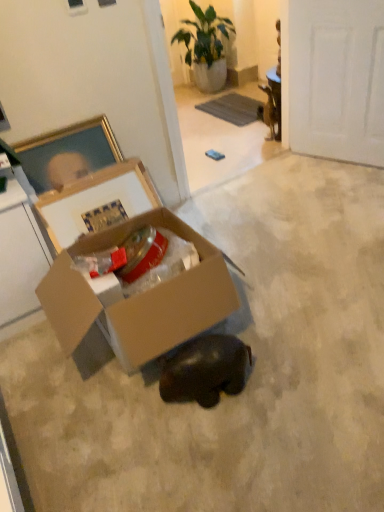
Question: Relative to green leafy plant at upper center, is cardboard box at center in front or behind?

Choices:
 (A) front
 (B) behind

Answer: (A)

Question: Visually, is cardboard box at center positioned to the left or to the right of green leafy plant at upper center?

Choices:
 (A) right
 (B) left

Answer: (B)

Question: Which is farther from the shiny black elephant at center?

Choices:
 (A) cardboard box at center
 (B) white matte door at upper right
 (C) green leafy plant at upper center

Answer: (C)

Question: Which of these objects is positioned farthest from the cardboard box at center?

Choices:
 (A) green leafy plant at upper center
 (B) shiny black elephant at center
 (C) white matte door at upper right

Answer: (A)